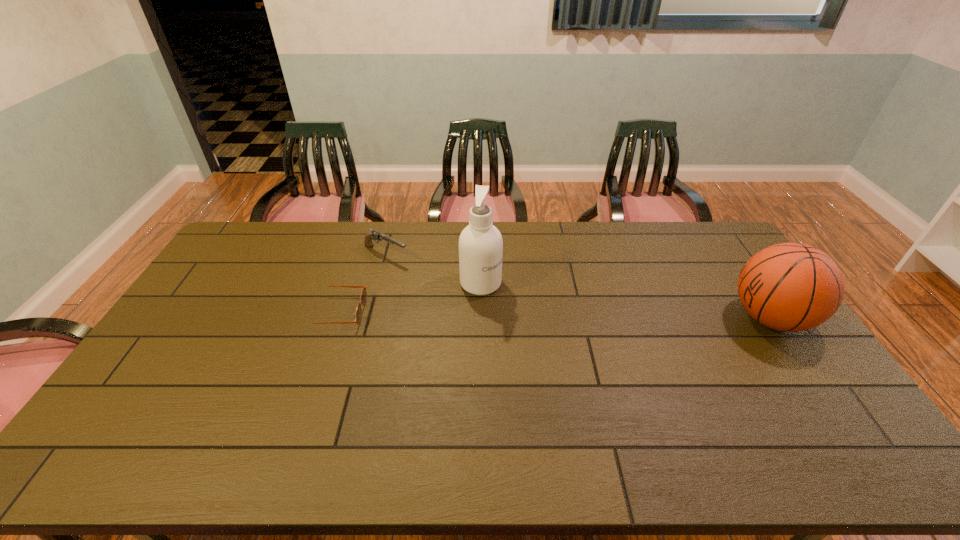
The height and width of the screenshot is (540, 960). In order to click on the shortest object in this screenshot , I will do `click(358, 313)`.

This screenshot has height=540, width=960. Identify the location of the second tallest object. (791, 287).

You are a GUI agent. You are given a task and a screenshot of the screen. Output one action in this format:
    pyautogui.click(x=<x>, y=<y>)
    Task: Click on the basketball
    This screenshot has width=960, height=540.
    Given the screenshot: What is the action you would take?
    791,287

Image resolution: width=960 pixels, height=540 pixels. What are the coordinates of `the tallest object` in the screenshot? It's located at (480, 243).

The image size is (960, 540). In order to click on cleansing agent in this screenshot , I will do `click(480, 243)`.

Where is `the third tallest object`? This screenshot has height=540, width=960. the third tallest object is located at coordinates (375, 235).

Find the location of a particular element. This screenshot has width=960, height=540. gun is located at coordinates (375, 235).

Locate an element on the screen. The image size is (960, 540). vacant space located on the front-facing side of the sunglasses is located at coordinates (472, 312).

Where is `vacant space located on the back of the second tallest object`? The image size is (960, 540). vacant space located on the back of the second tallest object is located at coordinates (728, 257).

The image size is (960, 540). Identify the location of blank area located 0.380m on the front label of the tallest object. (587, 360).